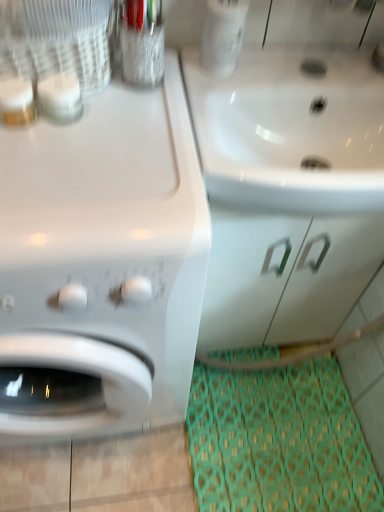
The height and width of the screenshot is (512, 384). What do you see at coordinates (285, 276) in the screenshot?
I see `white glossy drawer at center` at bounding box center [285, 276].

You are a GUI agent. You are given a task and a screenshot of the screen. Output one action in this format:
    pyautogui.click(x=<x>, y=<y>)
    Task: Click on the green fabric doormat at lower right
    The height and width of the screenshot is (512, 384).
    Given the screenshot: What is the action you would take?
    pos(279,441)

Find the location of a particular element. Image resolution: width=384 pixels, height=512 pixels. white glossy washing machine at left is located at coordinates (101, 265).

Who is taller, green fabric doormat at lower right or white glossy washing machine at left?

With more height is white glossy washing machine at left.

Considering the relative sizes of green fabric doormat at lower right and white glossy washing machine at left in the image provided, is green fabric doormat at lower right thinner than white glossy washing machine at left?

Yes, green fabric doormat at lower right is thinner than white glossy washing machine at left.

At what (x,y) coordinates should I click in order to perform the action: click on doormat below the white glossy washing machine at left (from a real-world perspective). Please return your answer as a coordinate pair (x, y). This screenshot has width=384, height=512. Looking at the image, I should click on 279,441.

From the image's perspective, relative to white glossy washing machine at left, is green fabric doormat at lower right above or below?

Clearly, from the image's perspective, green fabric doormat at lower right is below white glossy washing machine at left.

At what (x,y) coordinates should I click in order to perform the action: click on drawer on the right of white glossy washing machine at left. Please return your answer as a coordinate pair (x, y). The height and width of the screenshot is (512, 384). Looking at the image, I should click on (x=285, y=276).

Relative to white glossy washing machine at left, is white glossy drawer at center in front or behind?

In the image, white glossy drawer at center appears behind white glossy washing machine at left.

Is white glossy drawer at center placed right next to white glossy washing machine at left?

No.

Does point (313, 331) come closer to viewer compared to point (69, 302)?

No.

From a real-world perspective, is white glossy washing machine at left positioned under white glossy drawer at center based on gravity?

Incorrect, from a real-world perspective, white glossy washing machine at left is higher than white glossy drawer at center.

Is the position of white glossy washing machine at left more distant than that of white glossy drawer at center?

No, it is not.

Is white glossy washing machine at left positioned with its back to white glossy drawer at center?

That's not correct — white glossy washing machine at left is not looking away from white glossy drawer at center.

Which object is positioned more to the right, white glossy washing machine at left or white glossy drawer at center?

Positioned to the right is white glossy drawer at center.

Looking at the image, does green fabric doormat at lower right seem bigger or smaller compared to white glossy sink at upper right?

Considering their sizes, green fabric doormat at lower right takes up less space than white glossy sink at upper right.

Between green fabric doormat at lower right and white glossy sink at upper right, which one has smaller width?

Thinner between the two is white glossy sink at upper right.

From a real-world perspective, is green fabric doormat at lower right positioned under white glossy sink at upper right based on gravity?

Correct, in the physical world, green fabric doormat at lower right is lower than white glossy sink at upper right.

At what (x,y) coordinates should I click in order to perform the action: click on sink in front of the green fabric doormat at lower right. Please return your answer as a coordinate pair (x, y). Image resolution: width=384 pixels, height=512 pixels. Looking at the image, I should click on (291, 129).

From a real-world perspective, is green fabric doormat at lower right above or below white glossy drawer at center?

In terms of real-world spatial position, green fabric doormat at lower right is below white glossy drawer at center.

Is point (298, 500) behind point (264, 314)?

No.

Considering the relative sizes of green fabric doormat at lower right and white glossy drawer at center in the image provided, is green fabric doormat at lower right thinner than white glossy drawer at center?

No.

Considering the relative sizes of green fabric doormat at lower right and white glossy drawer at center in the image provided, is green fabric doormat at lower right shorter than white glossy drawer at center?

Yes.

Which object is positioned more to the left, white glossy washing machine at left or green fabric doormat at lower right?

Positioned to the left is white glossy washing machine at left.

Is white glossy washing machine at left far from green fabric doormat at lower right?

They are positioned close to each other.

Considering the relative sizes of white glossy washing machine at left and green fabric doormat at lower right in the image provided, is white glossy washing machine at left smaller than green fabric doormat at lower right?

No, white glossy washing machine at left is not smaller than green fabric doormat at lower right.

Which of these two, white glossy washing machine at left or green fabric doormat at lower right, stands taller?

With more height is white glossy washing machine at left.

Could you tell me if white glossy washing machine at left is facing white glossy sink at upper right?

No, white glossy washing machine at left is not oriented towards white glossy sink at upper right.

Does white glossy washing machine at left appear on the right side of white glossy sink at upper right?

No, white glossy washing machine at left is not to the right of white glossy sink at upper right.

From a real-world perspective, which is physically above, white glossy washing machine at left or white glossy sink at upper right?

From a 3D spatial view, white glossy sink at upper right is above.

Identify the location of doormat beneath the white glossy washing machine at left (from a real-world perspective). (279, 441).

The height and width of the screenshot is (512, 384). What are the coordinates of `washing machine on the left side of white glossy drawer at center` in the screenshot? It's located at (101, 265).

Considering their positions, is green fabric doormat at lower right positioned closer to white glossy drawer at center than white glossy sink at upper right?

white glossy sink at upper right.

Which object lies nearer to the anchor point white glossy sink at upper right, green fabric doormat at lower right or white glossy drawer at center?

Among the two, white glossy drawer at center is located nearer to white glossy sink at upper right.

Based on the photo, considering their positions, is white glossy washing machine at left positioned closer to green fabric doormat at lower right than white glossy drawer at center?

white glossy drawer at center.

Which object lies nearer to the anchor point white glossy washing machine at left, green fabric doormat at lower right or white glossy sink at upper right?

The object closer to white glossy washing machine at left is white glossy sink at upper right.

Considering their positions, is white glossy sink at upper right positioned closer to white glossy drawer at center than white glossy washing machine at left?

Based on the image, white glossy sink at upper right appears to be nearer to white glossy drawer at center.

Estimate the real-world distances between objects in this image. Which object is closer to white glossy washing machine at left, white glossy sink at upper right or white glossy drawer at center?

white glossy sink at upper right.

Which object lies further to the anchor point white glossy sink at upper right, green fabric doormat at lower right or white glossy washing machine at left?

Among the two, green fabric doormat at lower right is located further to white glossy sink at upper right.

Based on their spatial positions, is white glossy sink at upper right or white glossy drawer at center further from green fabric doormat at lower right?

white glossy sink at upper right.

Find the location of a particular element. The height and width of the screenshot is (512, 384). sink situated between white glossy washing machine at left and white glossy drawer at center from left to right is located at coordinates (291, 129).

In order to click on doormat between white glossy washing machine at left and white glossy drawer at center from left to right in this screenshot , I will do `click(279, 441)`.

Where is `washing machine between white glossy sink at upper right and green fabric doormat at lower right vertically`? The width and height of the screenshot is (384, 512). washing machine between white glossy sink at upper right and green fabric doormat at lower right vertically is located at coordinates (101, 265).

At what (x,y) coordinates should I click in order to perform the action: click on drawer between white glossy sink at upper right and green fabric doormat at lower right from top to bottom. Please return your answer as a coordinate pair (x, y). This screenshot has height=512, width=384. Looking at the image, I should click on (285, 276).